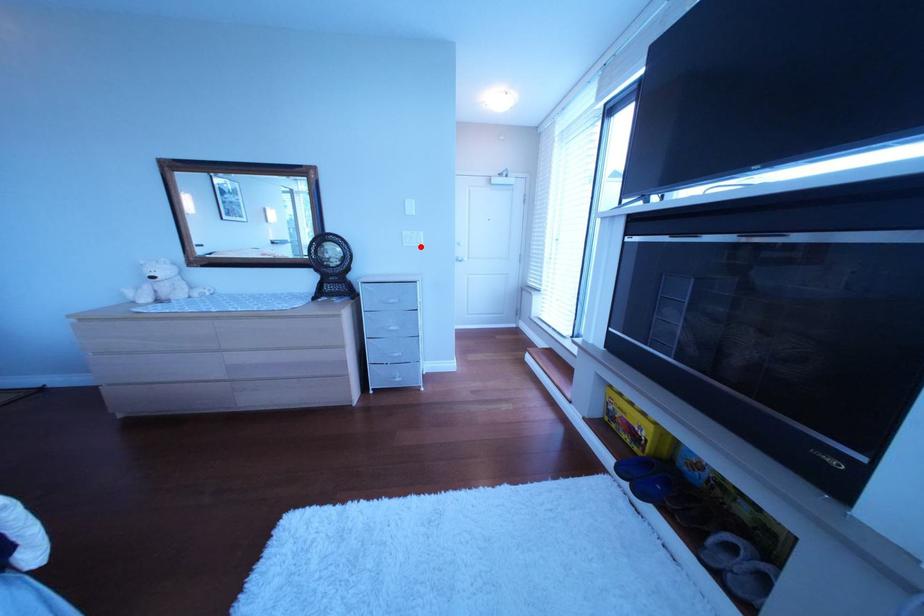
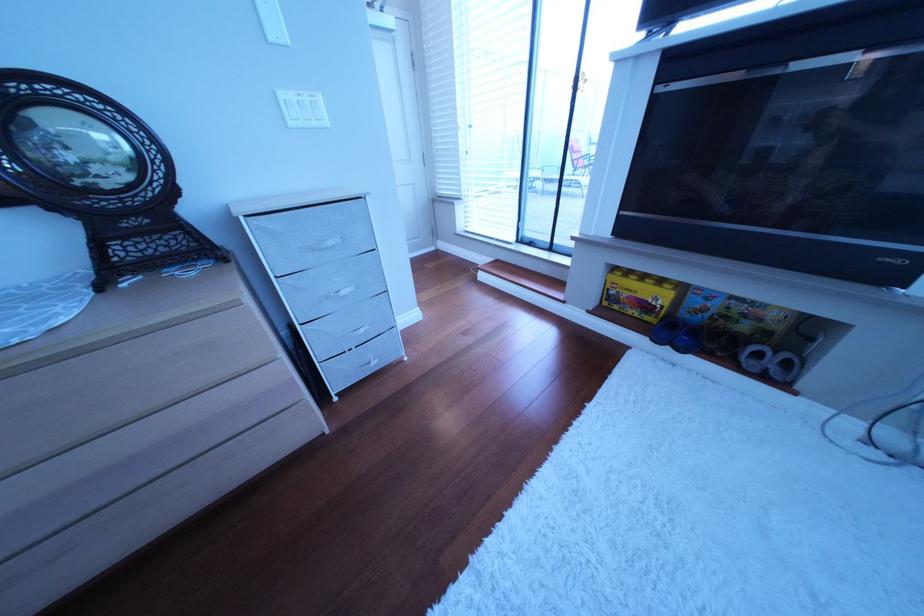
The point at the highlighted location is marked in the first image. Where is the corresponding point in the second image?

(307, 126)